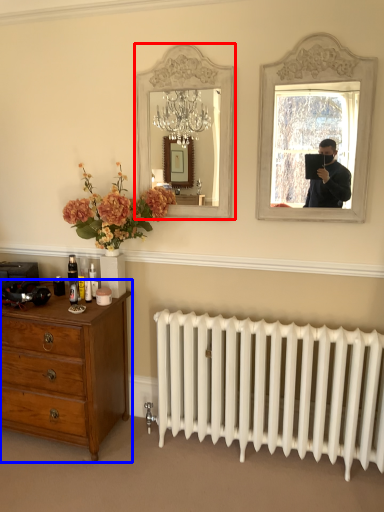
Question: Among these objects, which one is nearest to the camera, mirror (highlighted by a red box) or chest of drawers (highlighted by a blue box)?

Choices:
 (A) mirror
 (B) chest of drawers

Answer: (B)